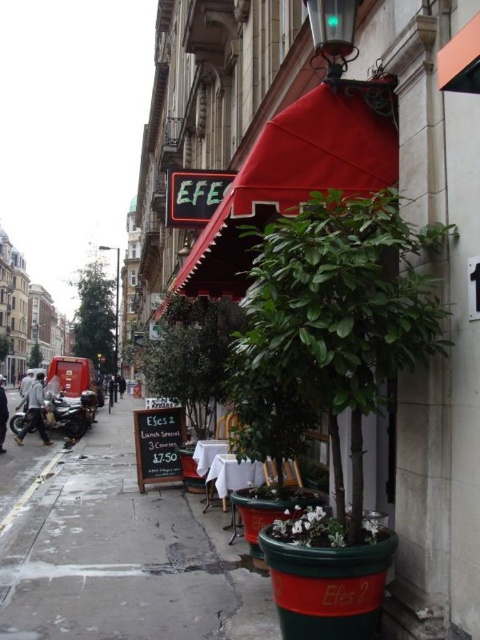
You are standing at point (x=3, y=381) and want to walk to the restaurant entrance. Is the point (x=286, y=538) in front of or behind you relative to your direction of travel?

Point (x=286, y=538) is in front of point (x=3, y=381), so it is in front of you as you walk toward the restaurant entrance.

You are standing on the sidewalk in front of the Efes restaurant. You notice two points marked on the ground. One is at coordinate point (305, 300) and the other is at point (111, 378). If you want to walk towards the point that is closer to you, which coordinate should you head towards?

You should head towards point (305, 300) because it is closer to the viewer than point (111, 378).

You are a delivery person who needs to place a package on the table closest to the green matte plant at center. Which direction should you move relative to the plant to reach the table?

The green matte plant at center is located at point (324, 528). Since the tables are set up under the awning, which is over the sidewalk, you should move towards the sidewalk direction relative to the plant to reach the nearest table.